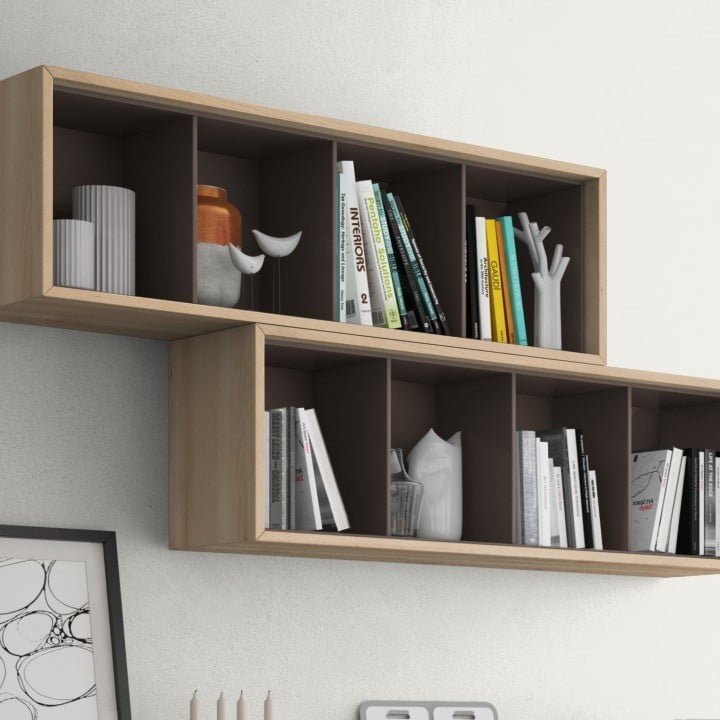
Identify the location of cubby hole shelves. (307, 446), (418, 413), (559, 405), (657, 412), (536, 260), (431, 202), (276, 186), (140, 168).